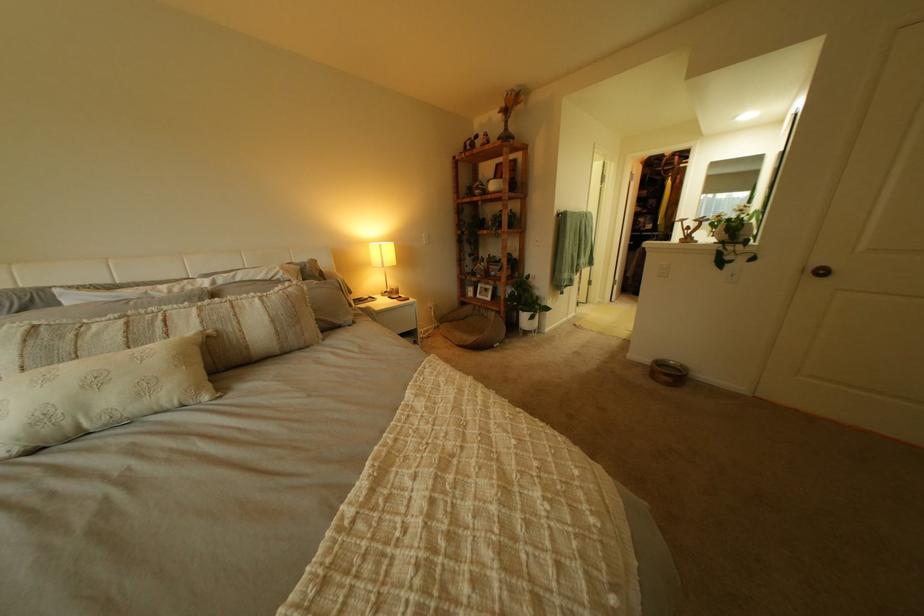
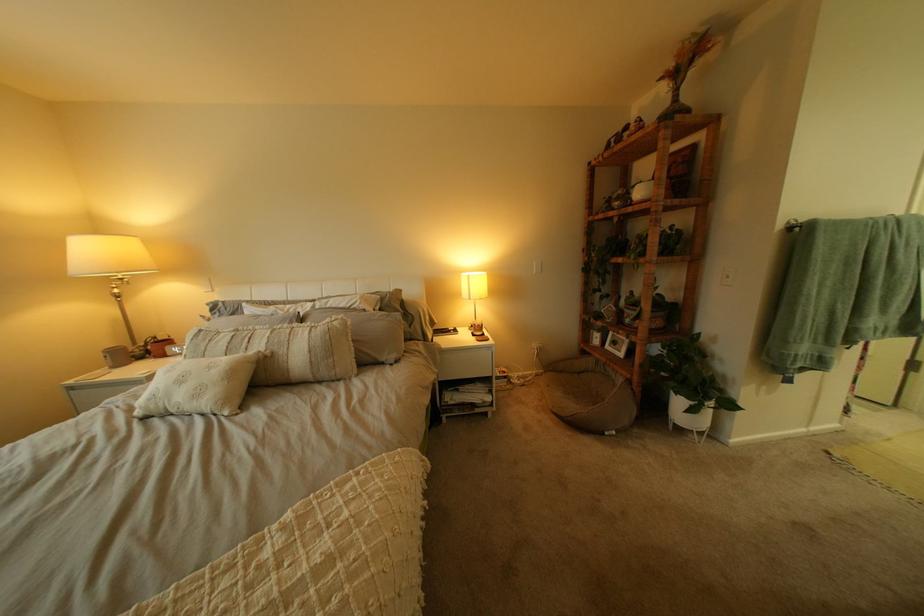
Find the pixel in the second image that matches [536,308] in the first image.

(687, 385)